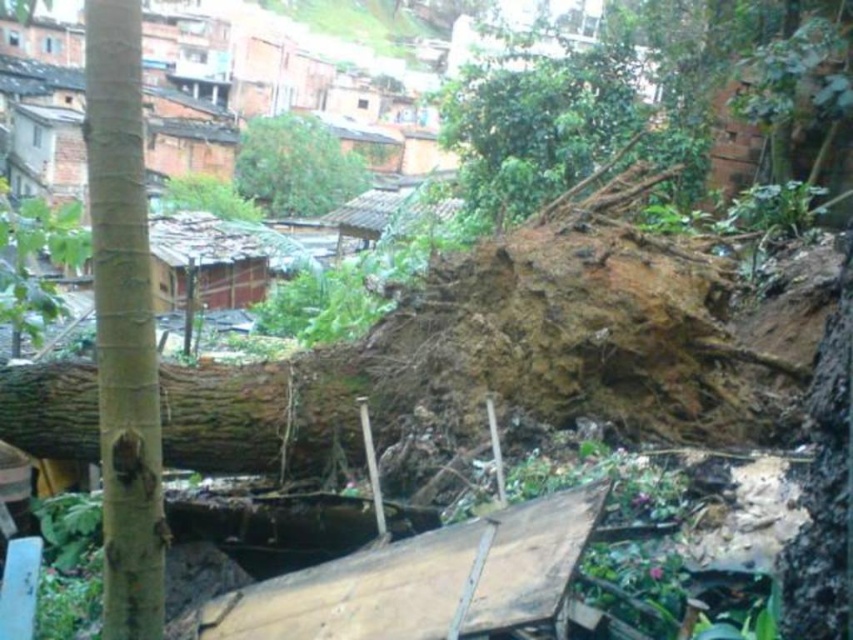
Does brown rough tree trunk at left appear on the left side of green leafy tree at upper center?

No, brown rough tree trunk at left is not to the left of green leafy tree at upper center.

Where is `brown rough tree trunk at left`? This screenshot has width=853, height=640. brown rough tree trunk at left is located at coordinates point(264,412).

Which is in front, point (57, 384) or point (300, 144)?

Point (57, 384) is more forward.

Where is `brown rough tree trunk at left`? The width and height of the screenshot is (853, 640). brown rough tree trunk at left is located at coordinates (264, 412).

Does point (143, 436) come in front of point (328, 394)?

Yes, it is in front of point (328, 394).

Is smooth brown tree trunk at left wider than brown rough tree trunk at left?

In fact, smooth brown tree trunk at left might be narrower than brown rough tree trunk at left.

Between point (94, 296) and point (67, 413), which one is positioned behind?

Point (67, 413)

Image resolution: width=853 pixels, height=640 pixels. Identify the location of smooth brown tree trunk at left. (123, 324).

Is point (306, 140) positioned after point (373, 241)?

That is True.

This screenshot has height=640, width=853. In order to click on green leafy tree at upper center in this screenshot , I will do `click(296, 166)`.